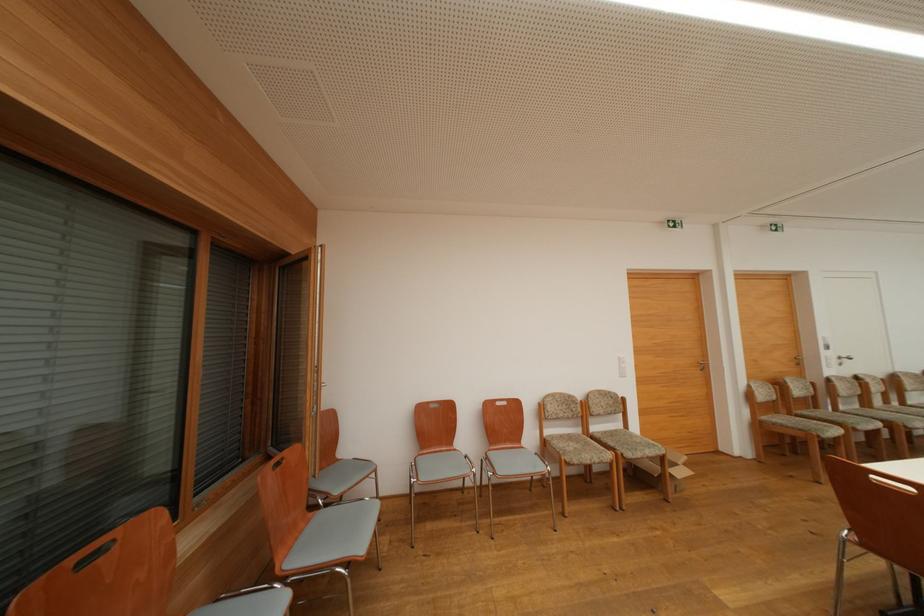
Find where to push the white light switch. Please return your answer as a coordinate pair (x, y).

(622, 366)